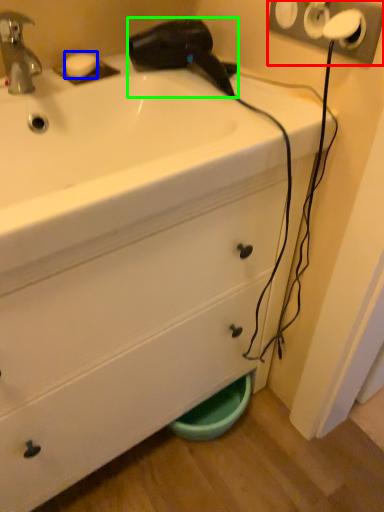
Question: Considering the real-world distances, which object is closest to electric outlet (highlighted by a red box)? soap (highlighted by a blue box) or hair drier (highlighted by a green box).

Choices:
 (A) soap
 (B) hair drier

Answer: (B)